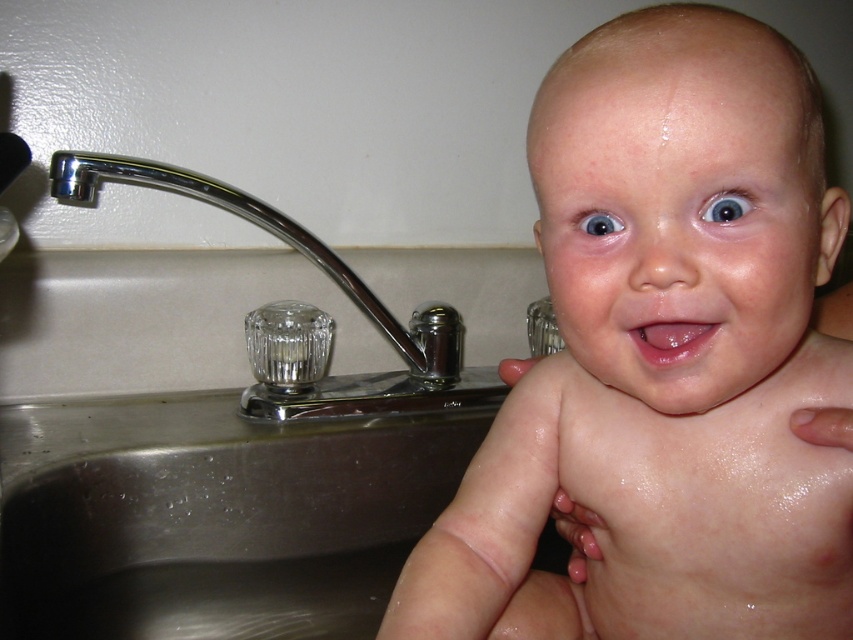
Question: Can you confirm if silver metallic sink at left is bigger than chrome/metallic faucet at left?

Choices:
 (A) no
 (B) yes

Answer: (B)

Question: Estimate the real-world distances between objects in this image. Which object is farther from the glossy skin baby at center?

Choices:
 (A) chrome/metallic faucet at left
 (B) silver metallic sink at left

Answer: (A)

Question: Which point appears farthest from the camera in this image?

Choices:
 (A) (428, 344)
 (B) (844, 216)
 (C) (178, 518)

Answer: (A)

Question: Does silver metallic sink at left appear on the right side of chrome/metallic faucet at left?

Choices:
 (A) yes
 (B) no

Answer: (A)

Question: Considering the relative positions of glossy skin baby at center and chrome/metallic faucet at left in the image provided, where is glossy skin baby at center located with respect to chrome/metallic faucet at left?

Choices:
 (A) below
 (B) above

Answer: (A)

Question: Which of the following is the farthest from the observer?

Choices:
 (A) chrome/metallic faucet at left
 (B) glossy skin baby at center
 (C) silver metallic sink at left

Answer: (A)